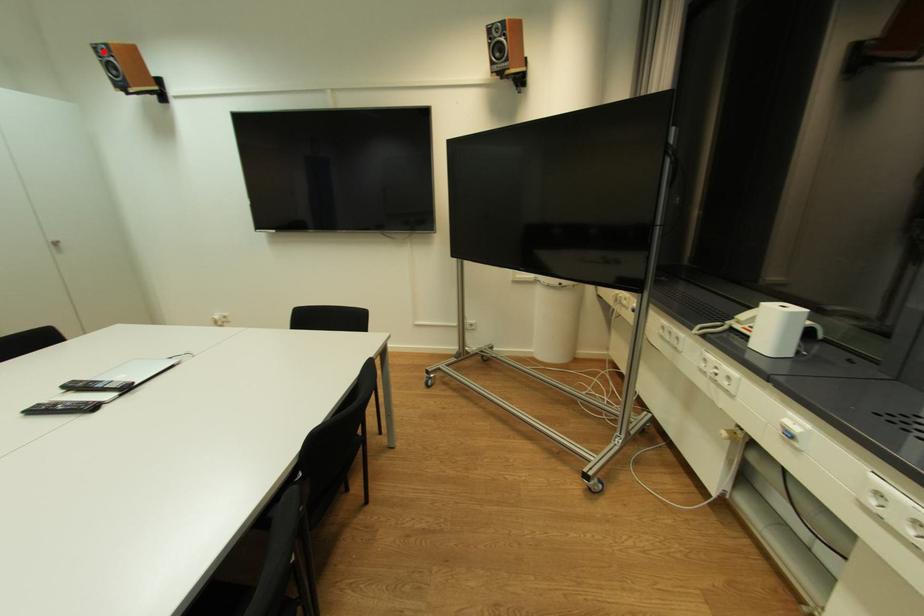
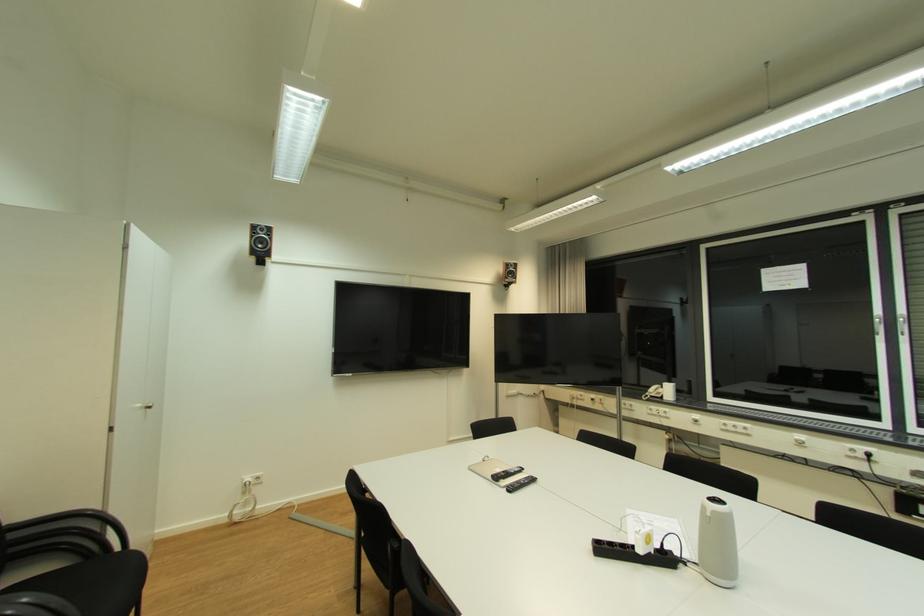
Find the pixel in the second image that matches the highlighted location in the first image.

(261, 228)